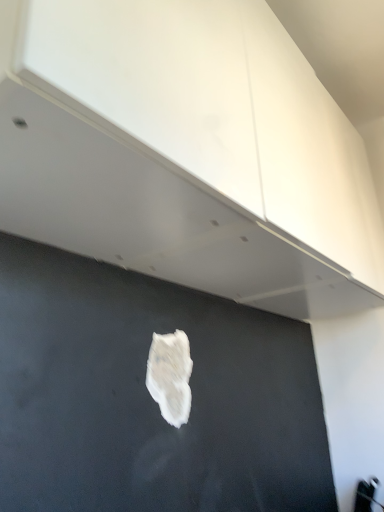
Question: Does white matte paper at center have a greater width compared to white glossy cabinet at upper center?

Choices:
 (A) no
 (B) yes

Answer: (A)

Question: Is white matte paper at center far away from white glossy cabinet at upper center?

Choices:
 (A) yes
 (B) no

Answer: (B)

Question: Is white matte paper at center positioned beyond the bounds of white glossy cabinet at upper center?

Choices:
 (A) no
 (B) yes

Answer: (B)

Question: Can you see white matte paper at center touching white glossy cabinet at upper center?

Choices:
 (A) no
 (B) yes

Answer: (A)

Question: From a real-world perspective, is white matte paper at center below white glossy cabinet at upper center?

Choices:
 (A) yes
 (B) no

Answer: (A)

Question: From the image's perspective, does white matte paper at center appear lower than white glossy cabinet at upper center?

Choices:
 (A) yes
 (B) no

Answer: (A)

Question: From the image's perspective, is white glossy cabinet at upper center below white matte paper at center?

Choices:
 (A) no
 (B) yes

Answer: (A)

Question: From a real-world perspective, is white glossy cabinet at upper center positioned over white matte paper at center based on gravity?

Choices:
 (A) no
 (B) yes

Answer: (B)

Question: Is white glossy cabinet at upper center aimed at white matte paper at center?

Choices:
 (A) no
 (B) yes

Answer: (A)

Question: Considering the relative sizes of white glossy cabinet at upper center and white matte paper at center in the image provided, is white glossy cabinet at upper center thinner than white matte paper at center?

Choices:
 (A) yes
 (B) no

Answer: (B)

Question: Is white glossy cabinet at upper center not close to white matte paper at center?

Choices:
 (A) yes
 (B) no

Answer: (B)

Question: From the image's perspective, is white glossy cabinet at upper center on white matte paper at center?

Choices:
 (A) yes
 (B) no

Answer: (A)

Question: In the image, is white glossy cabinet at upper center positioned in front of or behind white matte paper at center?

Choices:
 (A) front
 (B) behind

Answer: (A)